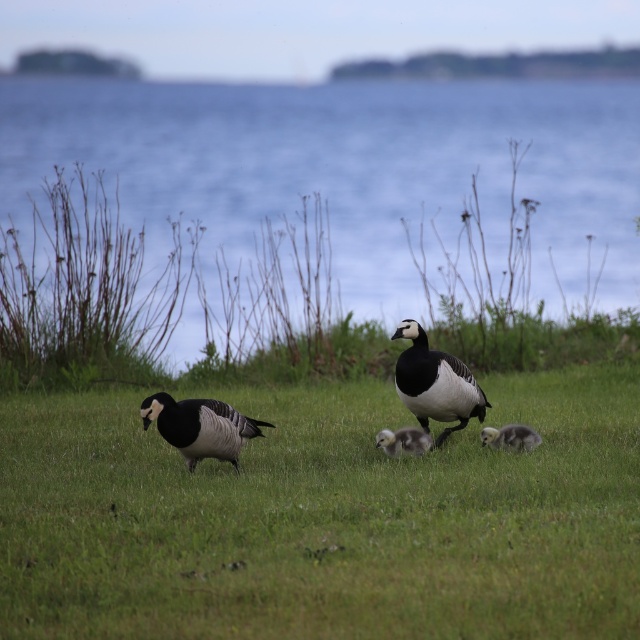
You are a photographer trying to capture a clear shot of the black glossy goose at center. However, the green grass at center is blocking your view. Can you determine if the grass is taller or shorter than the goose?

The green grass at center is shorter than the black glossy goose at center, so the grass is not tall enough to block your view of the goose.

You are a photographer trying to capture a closeup of the soft gray downy duckling at center and the soft gray downy gosling at lower right. Based on their positions, which one is closer to the camera?

The soft gray downy duckling at center is positioned under the soft gray downy gosling at lower right, meaning the duckling is closer to the camera.

You are a photographer trying to capture the soft gray downy duckling at center. The camera you are using has a focus point at coordinate point (403, 442). Is the soft gray downy duckling at center positioned at the focus point?

Yes, the soft gray downy duckling at center is positioned at point (403, 442), which matches the camera focus point.